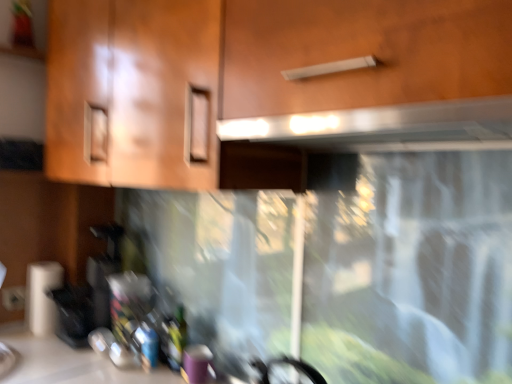
This screenshot has width=512, height=384. What do you see at coordinates (13, 298) in the screenshot?
I see `white plastic electric outlet at lower left` at bounding box center [13, 298].

What do you see at coordinates (353, 137) in the screenshot?
I see `satin silver exhaust hood at upper center` at bounding box center [353, 137].

The height and width of the screenshot is (384, 512). What do you see at coordinates (268, 86) in the screenshot?
I see `matte wood cabinet at upper center` at bounding box center [268, 86].

Find the location of a particular element. The height and width of the screenshot is (384, 512). green glass bottle at lower center is located at coordinates (175, 337).

Identify the location of white matte paper towel at lower left. (42, 296).

Relative to satin silver exhaust hood at upper center, is white matte paper towel at lower left in front or behind?

white matte paper towel at lower left is behind satin silver exhaust hood at upper center.

Based on their positions, is white matte paper towel at lower left located to the left or right of satin silver exhaust hood at upper center?

Based on their positions, white matte paper towel at lower left is located to the left of satin silver exhaust hood at upper center.

Does white matte paper towel at lower left have a lesser width compared to satin silver exhaust hood at upper center?

Indeed, white matte paper towel at lower left has a lesser width compared to satin silver exhaust hood at upper center.

Is white matte paper towel at lower left facing away from satin silver exhaust hood at upper center?

No.

From a real-world perspective, is satin silver exhaust hood at upper center physically located above or below matte wood cabinet at upper center?

In terms of real-world spatial position, satin silver exhaust hood at upper center is below matte wood cabinet at upper center.

Is satin silver exhaust hood at upper center further to camera compared to matte wood cabinet at upper center?

That is True.

From the image's perspective, relative to matte wood cabinet at upper center, is satin silver exhaust hood at upper center above or below?

Based on their image positions, satin silver exhaust hood at upper center is located beneath matte wood cabinet at upper center.

Looking at the image, does satin silver exhaust hood at upper center seem bigger or smaller compared to matte wood cabinet at upper center?

satin silver exhaust hood at upper center is smaller than matte wood cabinet at upper center.

In the image, there is a matte wood cabinet at upper center. At what (x,y) coordinates should I click in order to perform the action: click on paper towel below it (from the image's perspective). Please return your answer as a coordinate pair (x, y). Looking at the image, I should click on (42, 296).

Is matte wood cabinet at upper center next to white matte paper towel at lower left?

There is a gap between matte wood cabinet at upper center and white matte paper towel at lower left.

Which object is more forward, matte wood cabinet at upper center or white matte paper towel at lower left?

matte wood cabinet at upper center is closer to the camera.

How different are the orientations of matte wood cabinet at upper center and white matte paper towel at lower left in degrees?

The angular difference between matte wood cabinet at upper center and white matte paper towel at lower left is 3.89 degrees.

Is white plastic electric outlet at lower left taller than white matte paper towel at lower left?

In fact, white plastic electric outlet at lower left may be shorter than white matte paper towel at lower left.

Which of these two, white plastic electric outlet at lower left or white matte paper towel at lower left, is wider?

white matte paper towel at lower left.

From the image's perspective, is white plastic electric outlet at lower left on top of white matte paper towel at lower left?

No.

From a real-world perspective, between white plastic electric outlet at lower left and white matte paper towel at lower left, who is vertically lower?

From a 3D spatial view, white plastic electric outlet at lower left is below.

Considering the relative sizes of satin silver exhaust hood at upper center and white matte paper towel at lower left in the image provided, is satin silver exhaust hood at upper center wider than white matte paper towel at lower left?

Correct, the width of satin silver exhaust hood at upper center exceeds that of white matte paper towel at lower left.

Based on their sizes in the image, would you say satin silver exhaust hood at upper center is bigger or smaller than white matte paper towel at lower left?

Clearly, satin silver exhaust hood at upper center is larger in size than white matte paper towel at lower left.

How far apart are satin silver exhaust hood at upper center and white matte paper towel at lower left?

The distance of satin silver exhaust hood at upper center from white matte paper towel at lower left is 3.99 feet.

From the image's perspective, between satin silver exhaust hood at upper center and white plastic electric outlet at lower left, which one is located above?

From the image's view, satin silver exhaust hood at upper center is above.

Is satin silver exhaust hood at upper center directly adjacent to white plastic electric outlet at lower left?

satin silver exhaust hood at upper center and white plastic electric outlet at lower left are clearly separated.

Is point (464, 116) closer or farther from the camera than point (11, 296)?

Point (464, 116) is closer to the camera than point (11, 296).

Who is more distant, satin silver exhaust hood at upper center or white plastic electric outlet at lower left?

white plastic electric outlet at lower left is more distant.

Would you say white plastic electric outlet at lower left contains green glass bottle at lower center?

No, green glass bottle at lower center is located outside of white plastic electric outlet at lower left.

Could you tell me if white plastic electric outlet at lower left is turned towards green glass bottle at lower center?

Yes.

From a real-world perspective, does white plastic electric outlet at lower left stand above green glass bottle at lower center?

Indeed, from a real-world perspective, white plastic electric outlet at lower left stands above green glass bottle at lower center.

Based on their positions, is white plastic electric outlet at lower left located to the left or right of green glass bottle at lower center?

Clearly, white plastic electric outlet at lower left is on the left of green glass bottle at lower center in the image.

Image resolution: width=512 pixels, height=384 pixels. I want to click on paper towel behind the satin silver exhaust hood at upper center, so click(42, 296).

What are the coordinates of `cabinetry above the satin silver exhaust hood at upper center (from a real-world perspective)` in the screenshot? It's located at (268, 86).

Consider the image. When comparing their distances from matte wood cabinet at upper center, does white matte paper towel at lower left or white plastic electric outlet at lower left seem closer?

Among the two, white matte paper towel at lower left is located nearer to matte wood cabinet at upper center.

Based on their spatial positions, is satin silver exhaust hood at upper center or white matte paper towel at lower left further from white plastic electric outlet at lower left?

Based on the image, satin silver exhaust hood at upper center appears to be further to white plastic electric outlet at lower left.

Considering their positions, is matte wood cabinet at upper center positioned closer to green glass bottle at lower center than satin silver exhaust hood at upper center?

matte wood cabinet at upper center is positioned closer to the anchor green glass bottle at lower center.

Considering their positions, is satin silver exhaust hood at upper center positioned closer to matte wood cabinet at upper center than white matte paper towel at lower left?

satin silver exhaust hood at upper center lies closer to matte wood cabinet at upper center than the other object.

Which object lies nearer to the anchor point white matte paper towel at lower left, satin silver exhaust hood at upper center or green glass bottle at lower center?

green glass bottle at lower center.

Looking at the image, which one is located closer to satin silver exhaust hood at upper center, green glass bottle at lower center or white plastic electric outlet at lower left?

green glass bottle at lower center lies closer to satin silver exhaust hood at upper center than the other object.

When comparing their distances from green glass bottle at lower center, does satin silver exhaust hood at upper center or white matte paper towel at lower left seem further?

satin silver exhaust hood at upper center is further to green glass bottle at lower center.

Which object lies further to the anchor point satin silver exhaust hood at upper center, matte wood cabinet at upper center or green glass bottle at lower center?

The object further to satin silver exhaust hood at upper center is green glass bottle at lower center.

You are a GUI agent. You are given a task and a screenshot of the screen. Output one action in this format:
    pyautogui.click(x=<x>, y=<y>)
    Task: Click on the bottle between matte wood cabinet at upper center and white matte paper towel at lower left along the z-axis
    The width and height of the screenshot is (512, 384).
    Given the screenshot: What is the action you would take?
    pyautogui.click(x=175, y=337)

The image size is (512, 384). In order to click on exhaust hood between matte wood cabinet at upper center and white plastic electric outlet at lower left in the front-back direction in this screenshot , I will do `click(353, 137)`.

Locate an element on the screen. This screenshot has height=384, width=512. bottle located between satin silver exhaust hood at upper center and white matte paper towel at lower left in the depth direction is located at coordinates (175, 337).

Identify the location of paper towel located between white plastic electric outlet at lower left and green glass bottle at lower center in the left-right direction. (x=42, y=296).